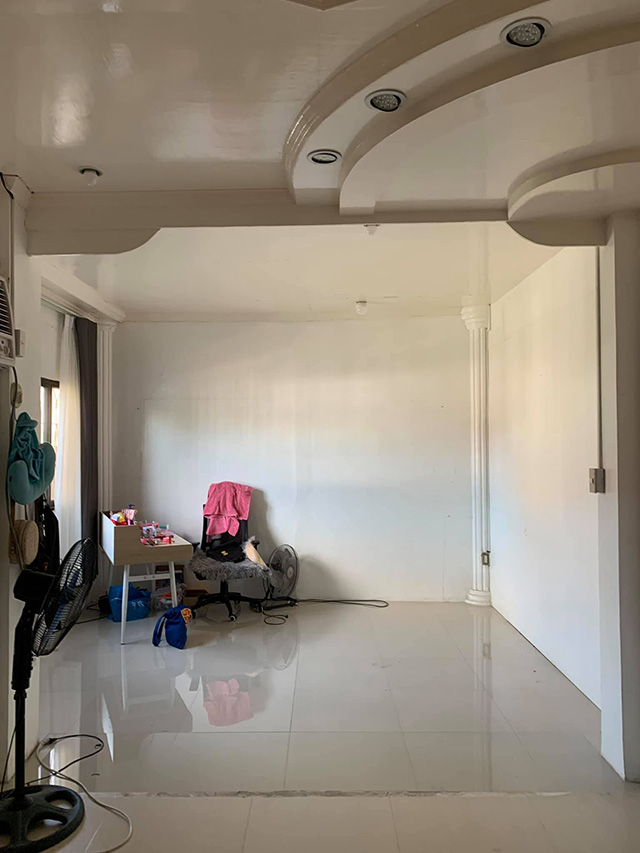
Image resolution: width=640 pixels, height=853 pixels. Identify the location of table legs. (125, 593), (172, 590), (153, 583), (112, 577).